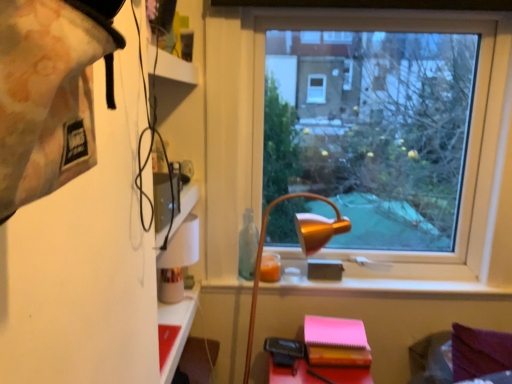
Question: Is the position of matte red table at lower left less distant than that of pink matte notebook at lower right?

Choices:
 (A) yes
 (B) no

Answer: (A)

Question: Is matte red table at lower left wider than pink matte notebook at lower right?

Choices:
 (A) yes
 (B) no

Answer: (B)

Question: Is matte red table at lower left to the left of pink matte notebook at lower right from the viewer's perspective?

Choices:
 (A) no
 (B) yes

Answer: (B)

Question: From a real-world perspective, is matte red table at lower left below pink matte notebook at lower right?

Choices:
 (A) yes
 (B) no

Answer: (A)

Question: Is matte red table at lower left shorter than pink matte notebook at lower right?

Choices:
 (A) yes
 (B) no

Answer: (B)

Question: Is transparent glass window at center to the left or to the right of matte red table at lower left in the image?

Choices:
 (A) right
 (B) left

Answer: (A)

Question: Considering their positions, is transparent glass window at center located in front of or behind matte red table at lower left?

Choices:
 (A) front
 (B) behind

Answer: (B)

Question: Is transparent glass window at center spatially inside matte red table at lower left, or outside of it?

Choices:
 (A) outside
 (B) inside

Answer: (A)

Question: Looking at the image, does transparent glass window at center seem bigger or smaller compared to matte red table at lower left?

Choices:
 (A) small
 (B) big

Answer: (B)

Question: From their relative heights in the image, would you say matte red table at lower left is taller or shorter than pink matte notebook at lower right?

Choices:
 (A) short
 (B) tall

Answer: (B)

Question: From the image's perspective, is matte red table at lower left above or below pink matte notebook at lower right?

Choices:
 (A) below
 (B) above

Answer: (A)

Question: Relative to pink matte notebook at lower right, is matte red table at lower left in front or behind?

Choices:
 (A) front
 (B) behind

Answer: (A)

Question: Is matte red table at lower left inside or outside of pink matte notebook at lower right?

Choices:
 (A) outside
 (B) inside

Answer: (A)

Question: Is matte red table at lower left wider or thinner than transparent glass window at center?

Choices:
 (A) wide
 (B) thin

Answer: (A)

Question: Based on their sizes in the image, would you say matte red table at lower left is bigger or smaller than transparent glass window at center?

Choices:
 (A) big
 (B) small

Answer: (B)